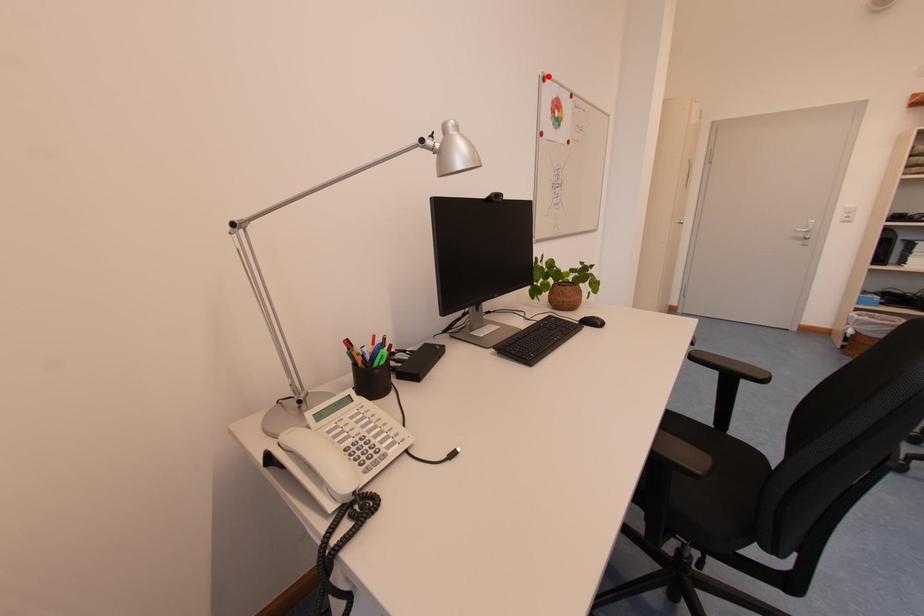
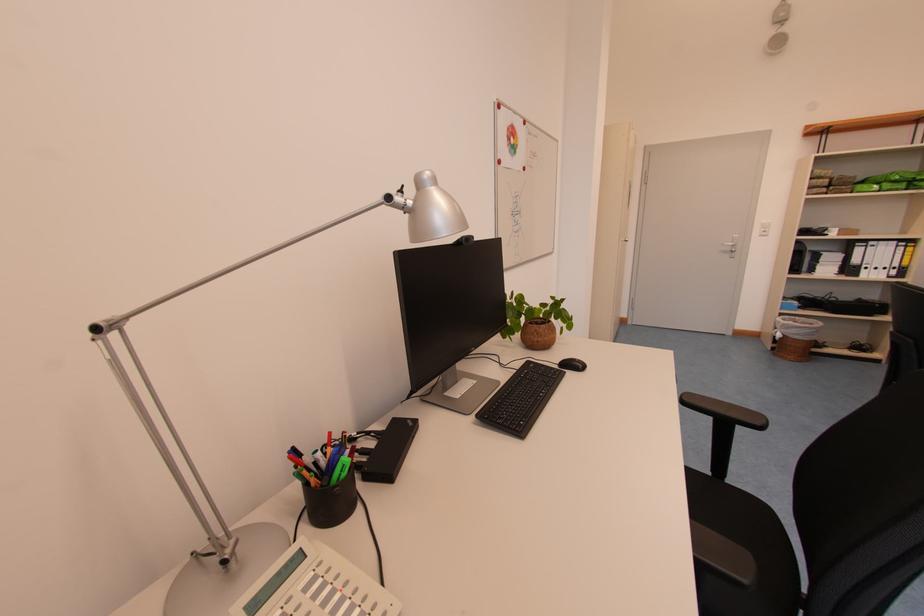
Locate, in the second image, the point that corresponds to the highlighted location in the first image.

(503, 103)